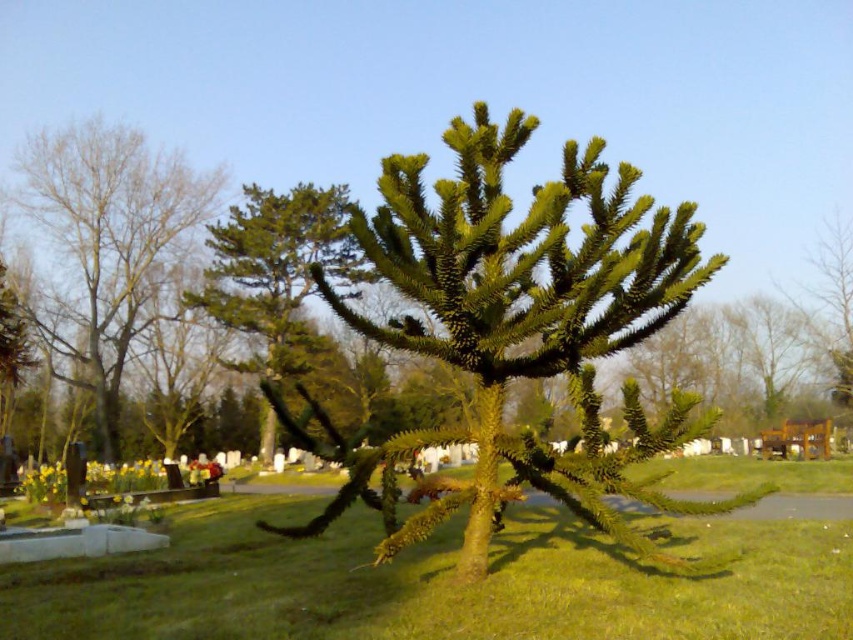
Question: Which object is positioned closest to the green spiky tree at center?

Choices:
 (A) green grass at center
 (B) green spiky tree at left

Answer: (A)

Question: Can you confirm if green grass at center is positioned below green spiky tree at center?

Choices:
 (A) no
 (B) yes

Answer: (B)

Question: Is green spiky tree at center positioned in front of green textured pine tree at upper left?

Choices:
 (A) yes
 (B) no

Answer: (A)

Question: Which object is the closest to the green grass at center?

Choices:
 (A) green spiky tree at center
 (B) green spiky tree at left

Answer: (A)

Question: Is green spiky tree at left above green textured pine tree at upper left?

Choices:
 (A) yes
 (B) no

Answer: (B)

Question: Estimate the real-world distances between objects in this image. Which object is farther from the green grass at center?

Choices:
 (A) green spiky tree at center
 (B) green textured pine tree at upper left

Answer: (B)